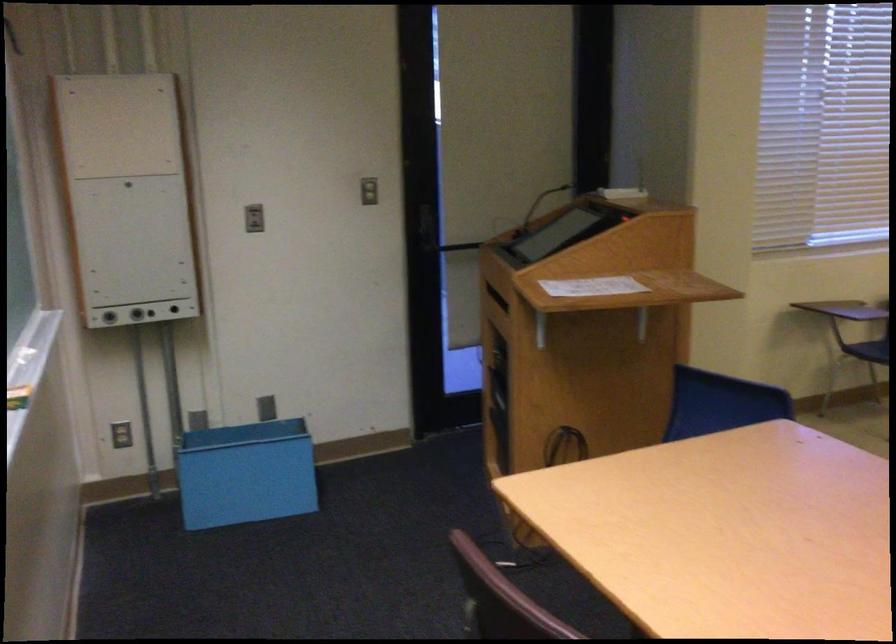
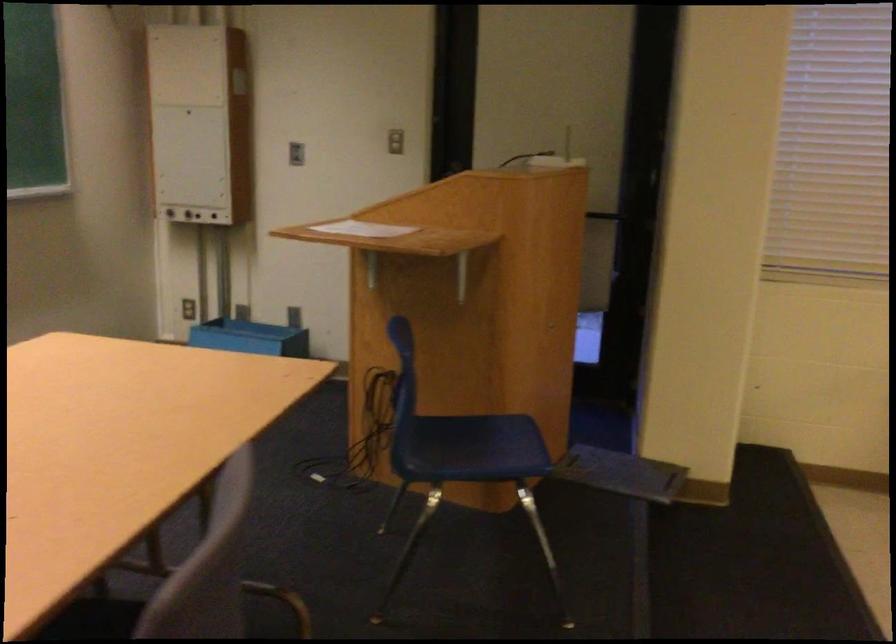
The point at (237, 446) is marked in the first image. Where is the corresponding point in the second image?

(250, 337)